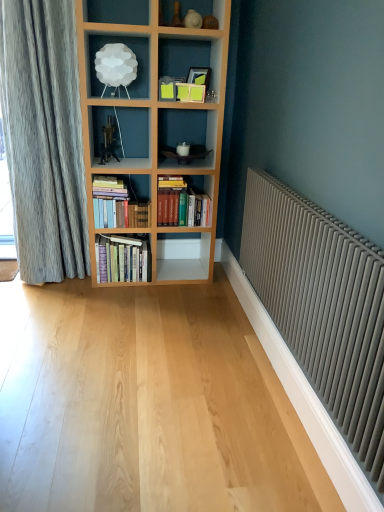
The height and width of the screenshot is (512, 384). In order to click on free region under matte gray radiator at right (from a real-world perspective) in this screenshot , I will do `click(283, 414)`.